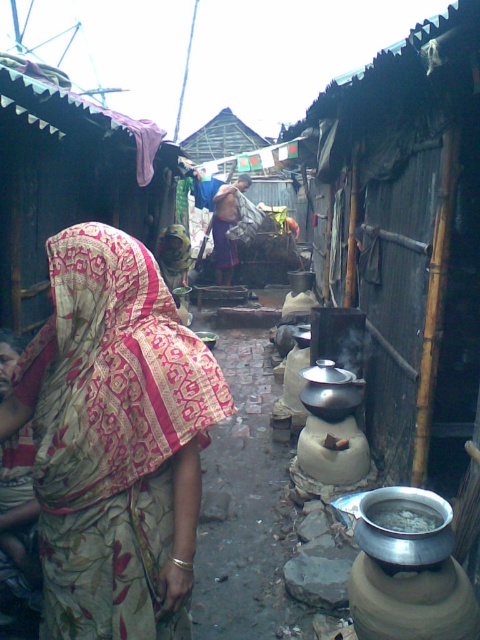
You are a delivery person with a cart that is 1.5 meters wide. You need to navigate through the alleyway to deliver a package. Can your cart pass between the patterned silk saree at center and the metallic silver pot at center?

The distance between the patterned silk saree at center and the metallic silver pot at center is 1.20 meters, which is narrower than the cart width of 1.5 meters. Therefore, the cart cannot pass through that space.

You are a delivery person trying to place a metallic silver pot at center on top of a patterned silk saree at center without damaging the saree. Is this possible given their sizes?

The patterned silk saree at center is taller than the metallic silver pot at center, so placing the metallic silver pot at center on top of the patterned silk saree at center might be possible as the saree is taller. However, the stability and safety of the saree could be compromised due to the pot potentially being heavier or the surface uneven.

You are a delivery person trying to navigate through the narrow alleyway. There is a patterned silk saree at center located at point (115,440). Can you safely walk around this saree without stepping on it?

The patterned silk saree at center is located at point (115,440). Since the alleyway is narrow and the saree is placed at the center, it might be challenging to walk around it without stepping on it. However, if there is enough space on either side of the saree, you could carefully step around it. The exact feasibility depends on the alleyway width and the saree size, which aren